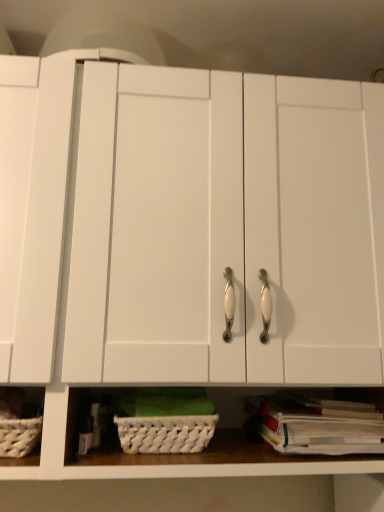
Image resolution: width=384 pixels, height=512 pixels. Find the location of `white woven basket at lower center`. white woven basket at lower center is located at coordinates (165, 433).

Describe the element at coordinates (165, 433) in the screenshot. I see `white woven basket at lower center` at that location.

What is the approximate width of white paper book at lower right?

The width of white paper book at lower right is 31.61 centimeters.

Measure the distance between white paper book at lower right and camera.

The depth of white paper book at lower right is 28.54 inches.

Locate an element on the screen. Image resolution: width=384 pixels, height=512 pixels. white paper book at lower right is located at coordinates (321, 426).

This screenshot has width=384, height=512. Describe the element at coordinates (321, 426) in the screenshot. I see `white paper book at lower right` at that location.

The image size is (384, 512). What are the coordinates of `white woven basket at lower center` in the screenshot? It's located at (165, 433).

Considering the positions of objects white woven basket at lower center and white paper book at lower right in the image provided, who is more to the right, white woven basket at lower center or white paper book at lower right?

white paper book at lower right.

Relative to white paper book at lower right, is white woven basket at lower center in front or behind?

Visually, white woven basket at lower center is located behind white paper book at lower right.

Is point (182, 443) closer to viewer compared to point (272, 439)?

Yes, point (182, 443) is closer to viewer.

From the image's perspective, which one is positioned lower, white woven basket at lower center or white paper book at lower right?

white paper book at lower right is shown below in the image.

From a real-world perspective, which object rests below the other?

white paper book at lower right, from a real-world perspective.

Can you confirm if white woven basket at lower center is thinner than white paper book at lower right?

Yes.

Which of these two, white woven basket at lower center or white paper book at lower right, stands taller?

With more height is white woven basket at lower center.

Does white woven basket at lower center have a smaller size compared to white paper book at lower right?

Indeed, white woven basket at lower center has a smaller size compared to white paper book at lower right.

Would you say white woven basket at lower center is outside white paper book at lower right?

white woven basket at lower center is positioned outside white paper book at lower right.

Are white woven basket at lower center and white paper book at lower right located far from each other?

That's not correct — white woven basket at lower center is a little close to white paper book at lower right.

Could you tell me if white woven basket at lower center is turned towards white paper book at lower right?

No, white woven basket at lower center is not aimed at white paper book at lower right.

The image size is (384, 512). Identify the location of book on the right of white woven basket at lower center. (321, 426).

Is white paper book at lower right at the left side of white woven basket at lower center?

In fact, white paper book at lower right is to the right of white woven basket at lower center.

Does white paper book at lower right come in front of white woven basket at lower center?

That is True.

In the scene shown: Which point is more forward, (320, 414) or (147, 430)?

The point (147, 430) is in front.

From the image's perspective, between white paper book at lower right and white woven basket at lower center, who is located below?

From the image's view, white paper book at lower right is below.

From a real-world perspective, is white paper book at lower right located beneath white woven basket at lower center?

Yes, from a real-world perspective, white paper book at lower right is below white woven basket at lower center.

Considering the relative sizes of white paper book at lower right and white woven basket at lower center in the image provided, is white paper book at lower right thinner than white woven basket at lower center?

Incorrect, the width of white paper book at lower right is not less than that of white woven basket at lower center.

Does white paper book at lower right have a greater height compared to white woven basket at lower center?

Incorrect, the height of white paper book at lower right is not larger of that of white woven basket at lower center.

Consider the image. Is white paper book at lower right smaller than white woven basket at lower center?

Incorrect, white paper book at lower right is not smaller in size than white woven basket at lower center.

Is white paper book at lower right surrounding white woven basket at lower center?

No, white paper book at lower right does not contain white woven basket at lower center.

Is white paper book at lower right positioned far away from white woven basket at lower center?

white paper book at lower right is near white woven basket at lower center, not far away.

Is white paper book at lower right facing away from white woven basket at lower center?

No.

How many degrees apart are the facing directions of white paper book at lower right and white woven basket at lower center?

The angle between the facing direction of white paper book at lower right and the facing direction of white woven basket at lower center is 0.00061 degrees.

What are the coordinates of `basket that is above the white paper book at lower right (from the image's perspective)` in the screenshot? It's located at (165, 433).

Find the location of a particular element. This screenshot has height=512, width=384. basket located on the left of white paper book at lower right is located at coordinates (165, 433).

At what (x,y) coordinates should I click in order to perform the action: click on book in front of the white woven basket at lower center. Please return your answer as a coordinate pair (x, y). Looking at the image, I should click on (321, 426).